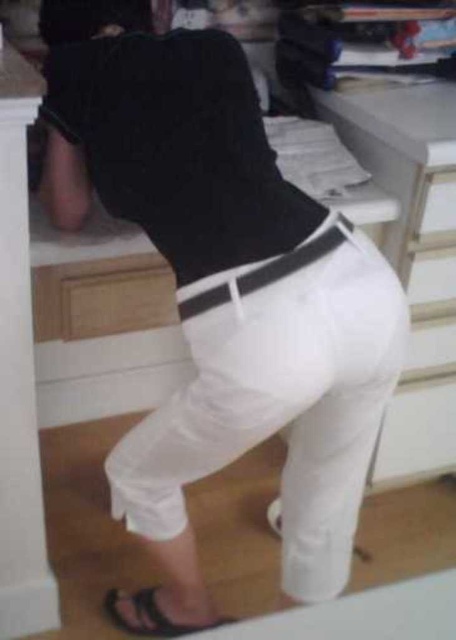
Which is below, black leather sandal at lower center or white matte drawer at center?

Positioned lower is black leather sandal at lower center.

Find the location of a particular element. black leather sandal at lower center is located at coordinates (150, 616).

The height and width of the screenshot is (640, 456). In order to click on black leather sandal at lower center in this screenshot , I will do `click(150, 616)`.